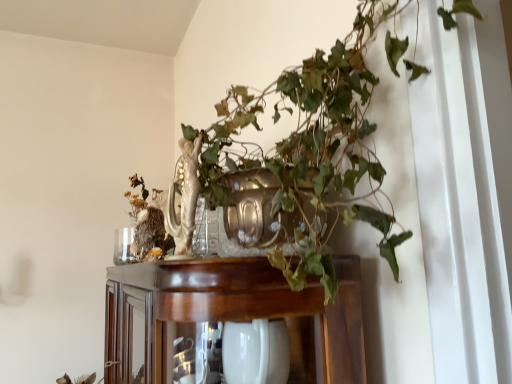
Identify the location of shiny brown cabinet at center. The image size is (512, 384). (233, 314).

Describe the element at coordinates (233, 314) in the screenshot. The width and height of the screenshot is (512, 384). I see `shiny brown cabinet at center` at that location.

Describe the element at coordinates (184, 198) in the screenshot. I see `porcelain statue at upper center` at that location.

Where is `porcelain statue at upper center`? porcelain statue at upper center is located at coordinates (184, 198).

This screenshot has width=512, height=384. Identify the location of shiny brown cabinet at center. (233, 314).

Looking at this image, which is more to the right, porcelain statue at upper center or shiny brown cabinet at center?

porcelain statue at upper center is more to the right.

In the scene shown: Does porcelain statue at upper center lie in front of shiny brown cabinet at center?

No, the depth of porcelain statue at upper center is greater than that of shiny brown cabinet at center.

Does point (191, 220) appear closer or farther from the camera than point (341, 285)?

Point (191, 220) is positioned farther from the camera compared to point (341, 285).

From the image's perspective, between porcelain statue at upper center and shiny brown cabinet at center, who is located below?

shiny brown cabinet at center is shown below in the image.

From a real-world perspective, is porcelain statue at upper center physically below shiny brown cabinet at center?

Actually, porcelain statue at upper center is physically above shiny brown cabinet at center in the real world.

Considering the sizes of porcelain statue at upper center and shiny brown cabinet at center in the image, is porcelain statue at upper center wider or thinner than shiny brown cabinet at center?

Clearly, porcelain statue at upper center has less width compared to shiny brown cabinet at center.

Does porcelain statue at upper center have a greater height compared to shiny brown cabinet at center?

No, porcelain statue at upper center is not taller than shiny brown cabinet at center.

Looking at the image, does porcelain statue at upper center seem bigger or smaller compared to shiny brown cabinet at center?

Considering their sizes, porcelain statue at upper center takes up less space than shiny brown cabinet at center.

Do you think porcelain statue at upper center is within shiny brown cabinet at center, or outside of it?

porcelain statue at upper center is not enclosed by shiny brown cabinet at center.

Is porcelain statue at upper center touching shiny brown cabinet at center?

No.

Does porcelain statue at upper center turn towards shiny brown cabinet at center?

No, porcelain statue at upper center is not oriented towards shiny brown cabinet at center.

How different are the orientations of porcelain statue at upper center and shiny brown cabinet at center in degrees?

There is a 1.91-degree angle between the facing directions of porcelain statue at upper center and shiny brown cabinet at center.

Locate an element on the screen. sculpture above the shiny brown cabinet at center (from a real-world perspective) is located at coordinates (184, 198).

Does shiny brown cabinet at center appear on the right side of porcelain statue at upper center?

No.

Is shiny brown cabinet at center positioned in front of porcelain statue at upper center?

Yes, shiny brown cabinet at center is closer to the viewer.

Which is nearer, (227, 298) or (193, 196)?

Point (227, 298) is closer to the camera than point (193, 196).

From the image's perspective, which object appears higher, shiny brown cabinet at center or porcelain statue at upper center?

porcelain statue at upper center appears higher in the image.

From a real-world perspective, is shiny brown cabinet at center positioned above or below porcelain statue at upper center?

From a real-world perspective, shiny brown cabinet at center is physically below porcelain statue at upper center.

Which of these two, shiny brown cabinet at center or porcelain statue at upper center, is thinner?

porcelain statue at upper center is thinner.

Does shiny brown cabinet at center have a greater height compared to porcelain statue at upper center?

Yes, shiny brown cabinet at center is taller than porcelain statue at upper center.

Who is bigger, shiny brown cabinet at center or porcelain statue at upper center?

shiny brown cabinet at center is bigger.

Is shiny brown cabinet at center inside or outside of porcelain statue at upper center?

shiny brown cabinet at center is outside porcelain statue at upper center.

Can you see shiny brown cabinet at center touching porcelain statue at upper center?

No, shiny brown cabinet at center is not next to porcelain statue at upper center.

Could you tell me if shiny brown cabinet at center is facing porcelain statue at upper center?

No.

How different are the orientations of shiny brown cabinet at center and porcelain statue at upper center in degrees?

1.91 degrees.

Measure the distance between shiny brown cabinet at center and porcelain statue at upper center.

shiny brown cabinet at center is 8.26 inches away from porcelain statue at upper center.

What are the coordinates of `sculpture behind the shiny brown cabinet at center` in the screenshot? It's located at (184, 198).

Locate an element on the screen. The width and height of the screenshot is (512, 384). furniture below the porcelain statue at upper center (from the image's perspective) is located at coordinates (233, 314).

Find the location of a particular element. furniture in front of the porcelain statue at upper center is located at coordinates (233, 314).